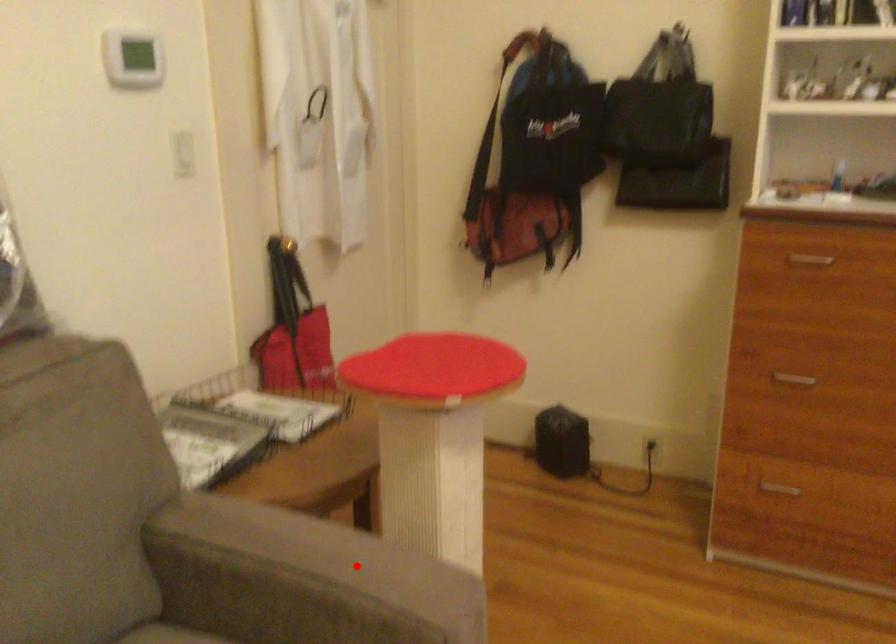
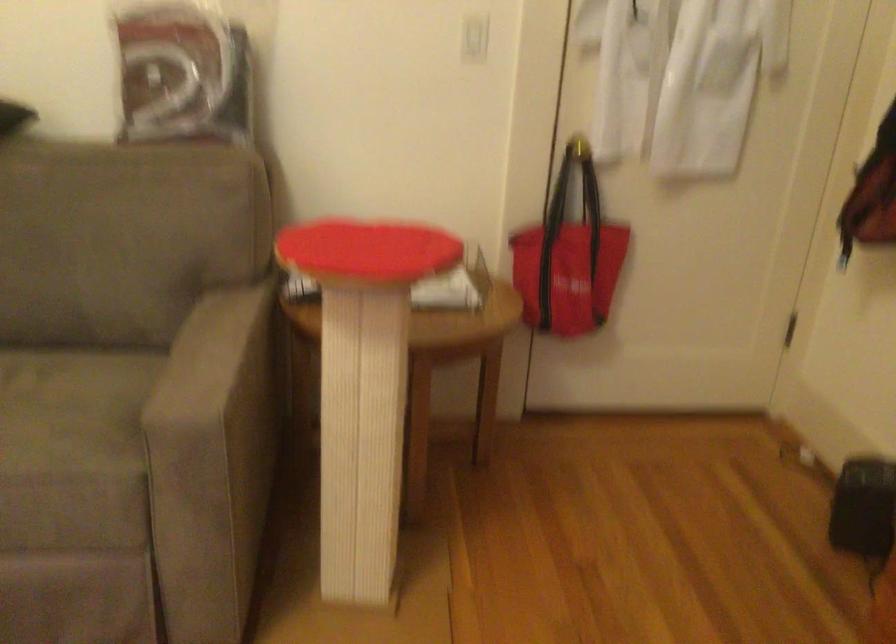
Question: I am providing you with two images of the same scene from different viewpoints. Image1 has a red point marked. In image2, the corresponding 3D location appears at what relative position? Reply with the corresponding letter.

Choices:
 (A) Closer
 (B) Farther

Answer: (B)